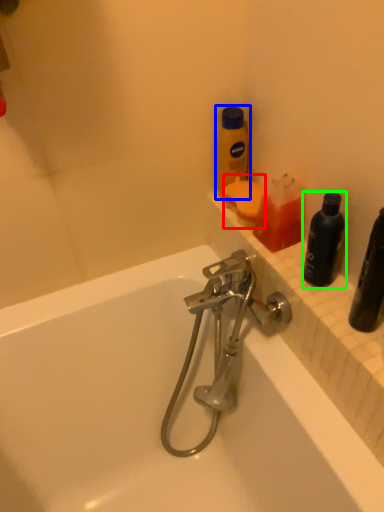
Question: Which object is the farthest from cleaning product (highlighted by a red box)? Choose among these: bottle (highlighted by a blue box) or bottle (highlighted by a green box).

Choices:
 (A) bottle
 (B) bottle

Answer: (B)